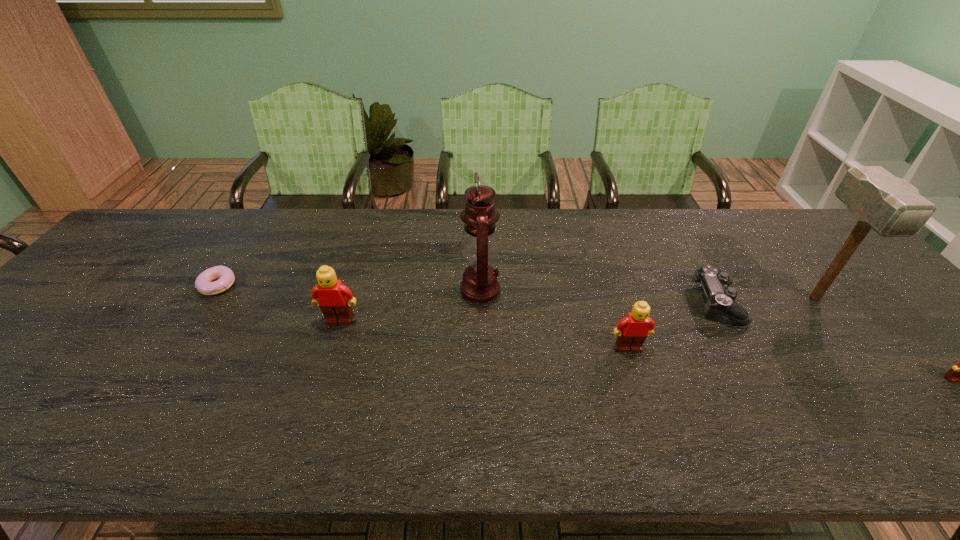
Identify the location of the leftmost Lego. (334, 299).

The height and width of the screenshot is (540, 960). I want to click on the sixth object from right to left, so click(334, 299).

I want to click on the fourth object from left to right, so click(632, 330).

You are a GUI agent. You are given a task and a screenshot of the screen. Output one action in this format:
    pyautogui.click(x=<x>, y=<y>)
    Task: Click on the second Lego from right to left
    The image size is (960, 540).
    Given the screenshot: What is the action you would take?
    pyautogui.click(x=632, y=330)

Find the location of a particular element. control is located at coordinates (721, 299).

This screenshot has height=540, width=960. Identify the location of the fifth object from left to right. (721, 299).

Image resolution: width=960 pixels, height=540 pixels. In order to click on oil lamp in this screenshot , I will do `click(480, 245)`.

I want to click on the shortest object, so point(203,283).

I want to click on doughnut, so click(203, 283).

Identify the location of the second object from right to left. (889, 205).